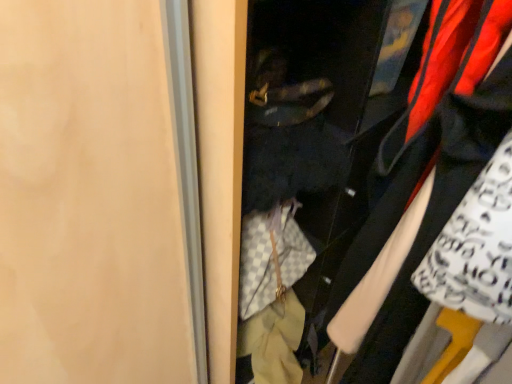
Describe the element at coordinates (372, 145) in the screenshot. I see `checkerboard fabric purse at center` at that location.

From the picture: Measure the distance between checkerboard fabric purse at center and camera.

15.06 inches.

Where is `checkerboard fabric purse at center`? The height and width of the screenshot is (384, 512). checkerboard fabric purse at center is located at coordinates (372, 145).

The image size is (512, 384). Find the location of `checkerboard fabric purse at center`. checkerboard fabric purse at center is located at coordinates (372, 145).